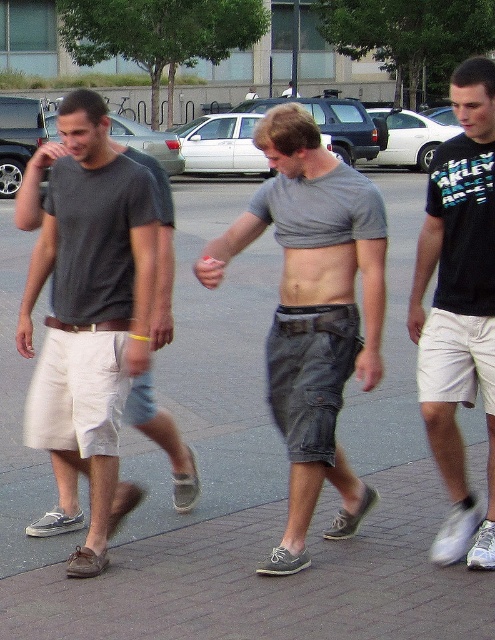
You are a photographer trying to capture the matte gray t shirt at left in the image. The camera you are using has a limited field of view. Can you estimate whether the point at coordinates (91, 312) is within the frame of the image?

The matte gray t shirt at left is represented by point (91, 312), so yes, the point at coordinates (91, 312) is within the frame of the image.

You are standing at the position of the man on the left and want to throw a small ball to the man in gray cotton shorts at center. What is the minimum distance you need to throw the ball?

The minimum distance you need to throw the ball is 16.73 feet to reach the man in gray cotton shorts at center.